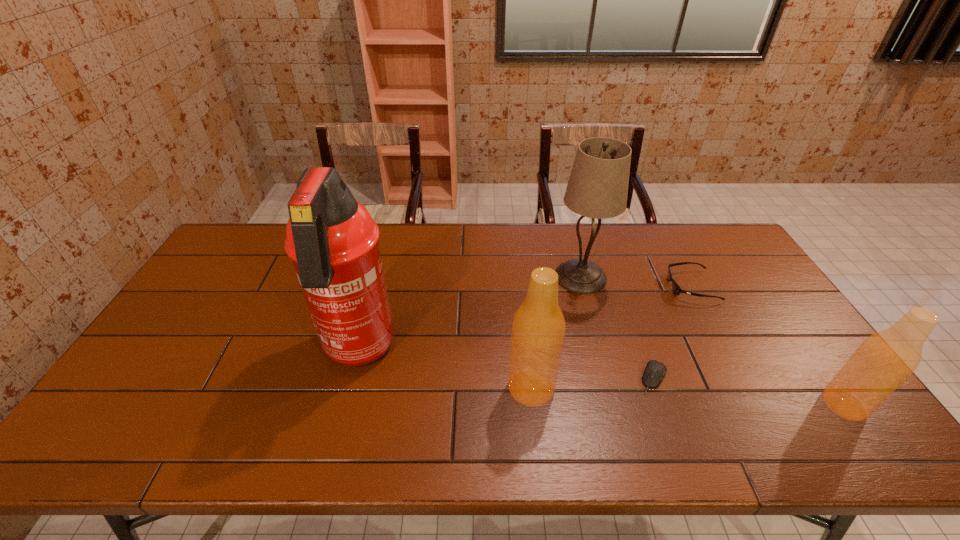
The width and height of the screenshot is (960, 540). Find the location of `fire extinguisher that is positioned at the near edge`. fire extinguisher that is positioned at the near edge is located at coordinates (332, 240).

In order to click on computer mouse that is at the near edge in this screenshot , I will do `click(655, 370)`.

Where is `beer bottle that is positioned at the right edge`? The height and width of the screenshot is (540, 960). beer bottle that is positioned at the right edge is located at coordinates (884, 360).

At what (x,y) coordinates should I click in order to perform the action: click on sunglasses at the right edge. Please return your answer as a coordinate pair (x, y). Looking at the image, I should click on (677, 290).

Identify the location of object at the near right corner. The image size is (960, 540). (884, 360).

Find the location of a particular element. free region at the far edge of the desktop is located at coordinates (462, 227).

The height and width of the screenshot is (540, 960). In order to click on vacant space at the near edge of the desktop in this screenshot , I will do `click(300, 388)`.

In the image, there is a desktop. At what (x,y) coordinates should I click in order to perform the action: click on vacant space at the left edge. Please return your answer as a coordinate pair (x, y). This screenshot has width=960, height=540. Looking at the image, I should click on (163, 344).

What are the coordinates of `vacant area at the far left corner of the desktop` in the screenshot? It's located at (242, 263).

The image size is (960, 540). Find the location of `free space at the far right corner`. free space at the far right corner is located at coordinates (709, 240).